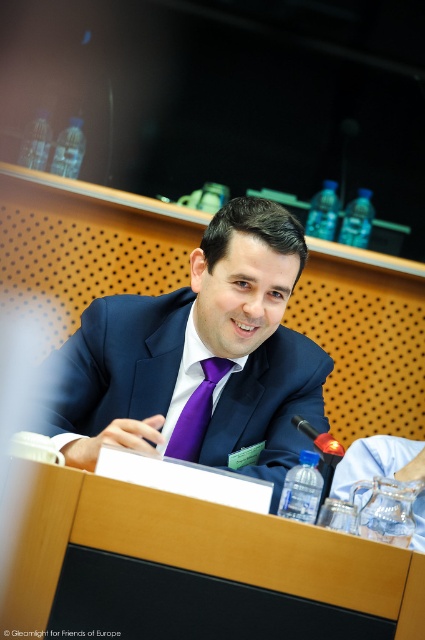
Can you confirm if matte black suit at center is positioned to the left of clear glass water at lower right?

Indeed, matte black suit at center is positioned on the left side of clear glass water at lower right.

Can you confirm if matte black suit at center is shorter than clear glass water at lower right?

No.

Which is in front, point (277, 241) or point (380, 445)?

Positioned in front is point (277, 241).

At what (x,y) coordinates should I click in order to perform the action: click on matte black suit at center. Please return your answer as a coordinate pair (x, y). Looking at the image, I should click on (200, 356).

Does wooden table at center lie behind purple satin tie at center?

That is False.

Identify the location of wooden table at center. The height and width of the screenshot is (640, 425). [189, 566].

Locate an element on the screen. wooden table at center is located at coordinates (189, 566).

Can you confirm if wooden table at center is shorter than matte black suit at center?

Yes, wooden table at center is shorter than matte black suit at center.

Locate an element on the screen. wooden table at center is located at coordinates (189, 566).